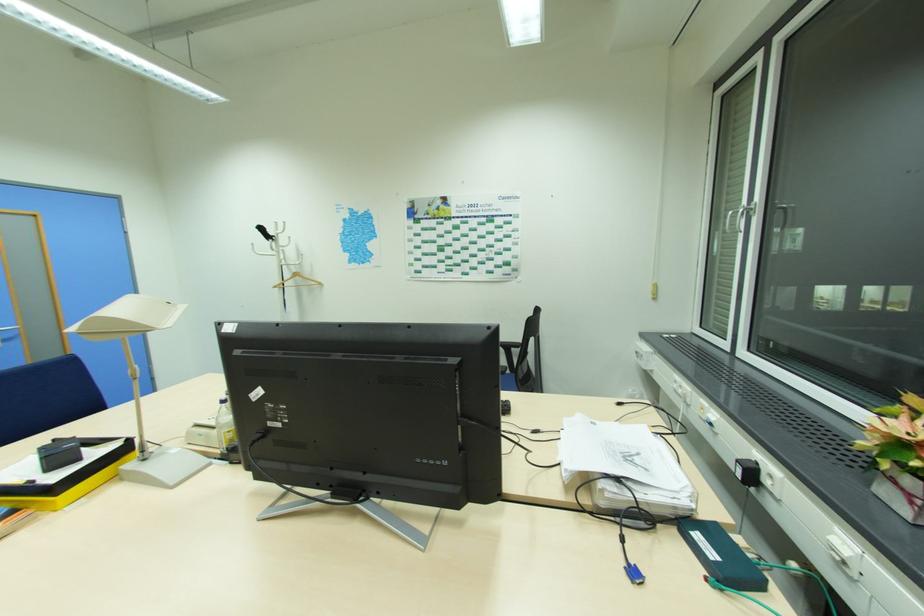
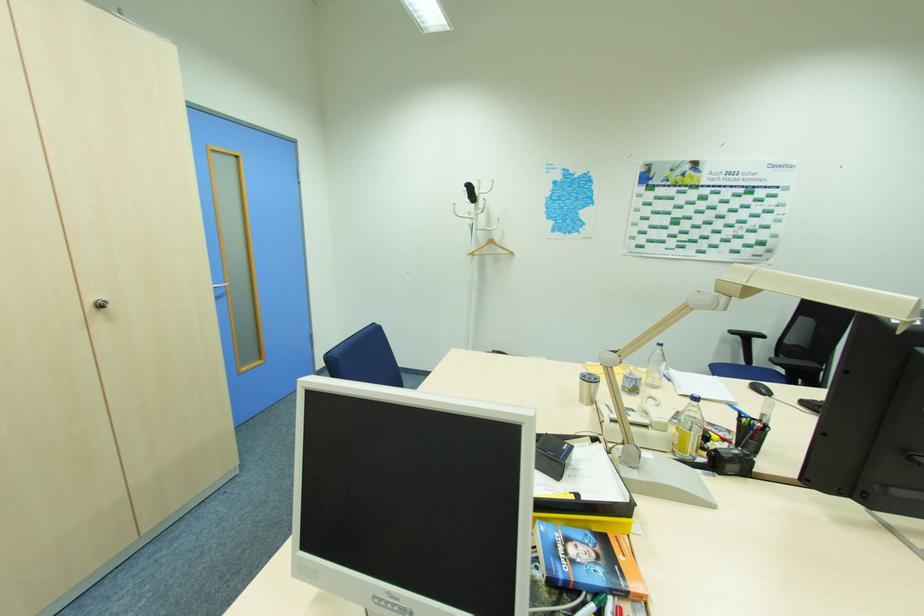
Locate, in the second image, the point that corresponds to point 259,254 in the first image.

(459, 216)